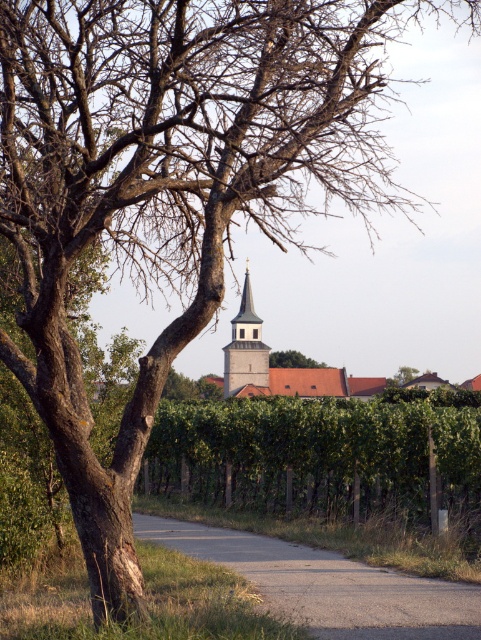
Who is positioned more to the right, green leafy hedge at center or asphalt road at center?

From the viewer's perspective, green leafy hedge at center appears more on the right side.

Which is behind, point (283, 484) or point (346, 614)?

The point (283, 484) is behind.

You are a GUI agent. You are given a task and a screenshot of the screen. Output one action in this format:
    pyautogui.click(x=<x>, y=<y>)
    Task: Click on the green leafy hedge at center
    The height and width of the screenshot is (640, 481).
    Given the screenshot: What is the action you would take?
    pyautogui.click(x=321, y=456)

Based on the photo, does asphalt road at center have a greater height compared to light gray stone tower at center?

In fact, asphalt road at center may be shorter than light gray stone tower at center.

Does asphalt road at center have a larger size compared to light gray stone tower at center?

Incorrect, asphalt road at center is not larger than light gray stone tower at center.

Measure the distance between point (x=291, y=547) and camera.

Point (x=291, y=547) is 62.74 feet away from camera.

Where is `asphalt road at center`? The image size is (481, 640). asphalt road at center is located at coordinates (328, 586).

Is light gray stone tower at center behind brown rough bark tree at center?

No.

Which is behind, point (266, 371) or point (287, 360)?

The point (287, 360) is behind.

Who is more forward, (229, 362) or (314, 362)?

Positioned in front is point (229, 362).

At what (x,y) coordinates should I click in order to perform the action: click on light gray stone tower at center. Please return your answer as a coordinate pair (x, y). Looking at the image, I should click on (245, 349).